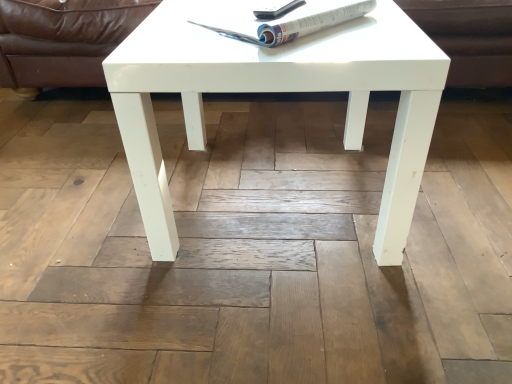
Find the location of a particular element. This screenshot has height=384, width=512. blank area to the left of white glossy magazine at upper center is located at coordinates (174, 24).